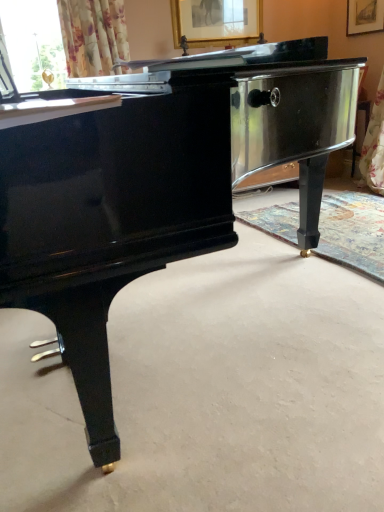
Question: From the image's perspective, is gold metallic piano leg at center beneath gold-framed picture at upper center?

Choices:
 (A) no
 (B) yes

Answer: (B)

Question: From a real-world perspective, is gold metallic piano leg at center beneath gold-framed picture at upper center?

Choices:
 (A) yes
 (B) no

Answer: (A)

Question: Is the position of gold metallic piano leg at center less distant than that of gold-framed picture at upper center?

Choices:
 (A) no
 (B) yes

Answer: (B)

Question: Is gold-framed picture at upper center located within gold metallic piano leg at center?

Choices:
 (A) no
 (B) yes

Answer: (A)

Question: Is gold metallic piano leg at center smaller than gold-framed picture at upper center?

Choices:
 (A) no
 (B) yes

Answer: (A)

Question: Is gold metallic piano leg at center shorter than gold-framed picture at upper center?

Choices:
 (A) no
 (B) yes

Answer: (B)

Question: From the image's perspective, does gold-framed picture at upper center appear higher than gold metallic piano leg at center?

Choices:
 (A) no
 (B) yes

Answer: (B)

Question: Does gold-framed picture at upper center come in front of gold metallic piano leg at center?

Choices:
 (A) no
 (B) yes

Answer: (A)

Question: From a real-world perspective, does gold-framed picture at upper center sit lower than gold metallic piano leg at center?

Choices:
 (A) no
 (B) yes

Answer: (A)

Question: Is gold-framed picture at upper center outside gold metallic piano leg at center?

Choices:
 (A) no
 (B) yes

Answer: (B)

Question: Does gold-framed picture at upper center have a smaller size compared to gold metallic piano leg at center?

Choices:
 (A) yes
 (B) no

Answer: (A)

Question: Does gold-framed picture at upper center have a greater width compared to gold metallic piano leg at center?

Choices:
 (A) yes
 (B) no

Answer: (B)

Question: From a real-world perspective, relative to gold metallic piano leg at center, is gold-framed picture at upper center vertically above or below?

Choices:
 (A) below
 (B) above

Answer: (B)